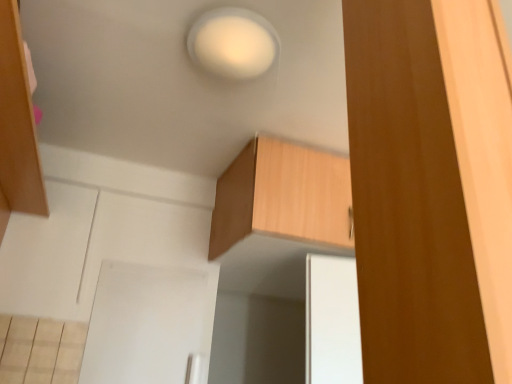
Identify the location of wooden cabinet at upper center, which appears as the second cabinetry when viewed from the front. This screenshot has height=384, width=512. (283, 197).

This screenshot has width=512, height=384. Identify the location of white matte light at upper center. (233, 43).

Considering the relative positions of white matte light at upper center and wooden cabinet at upper center, which appears as the second cabinetry when viewed from the front, in the image provided, is white matte light at upper center to the right of wooden cabinet at upper center, which appears as the second cabinetry when viewed from the front, from the viewer's perspective?

Incorrect, white matte light at upper center is not on the right side of wooden cabinet at upper center, which appears as the second cabinetry when viewed from the front.

From the image's perspective, is white matte light at upper center above or below wooden cabinet at upper center, which appears as the second cabinetry when viewed from the front?

From the image's perspective, white matte light at upper center appears above wooden cabinet at upper center, which appears as the second cabinetry when viewed from the front.

From the picture: Is white matte light at upper center oriented away from wooden cabinet at upper center, which is counted as the first cabinetry, starting from the back?

No, wooden cabinet at upper center, which is counted as the first cabinetry, starting from the back, is not at the back of white matte light at upper center.

Would you say white matte light at upper center contains wooden cabinet at upper center, which appears as the second cabinetry when viewed from the front?

Definitely not — wooden cabinet at upper center, which appears as the second cabinetry when viewed from the front, is not inside white matte light at upper center.

Can you tell me how much brown wood cabinet at right, which is the 2th cabinetry in back-to-front order, and wooden cabinet at upper center, which is counted as the first cabinetry, starting from the back, differ in facing direction?

95.8 degrees separate the facing orientations of brown wood cabinet at right, which is the 2th cabinetry in back-to-front order, and wooden cabinet at upper center, which is counted as the first cabinetry, starting from the back.

From a real-world perspective, is brown wood cabinet at right, which is the 2th cabinetry in back-to-front order, positioned over wooden cabinet at upper center, which appears as the second cabinetry when viewed from the front, based on gravity?

No, from a real-world perspective, brown wood cabinet at right, which is the 2th cabinetry in back-to-front order, is not over wooden cabinet at upper center, which appears as the second cabinetry when viewed from the front

From the image's perspective, relative to wooden cabinet at upper center, which appears as the second cabinetry when viewed from the front, is brown wood cabinet at right, the 1th cabinetry from the front, above or below?

brown wood cabinet at right, the 1th cabinetry from the front, is above wooden cabinet at upper center, which appears as the second cabinetry when viewed from the front.

How much distance is there between brown wood cabinet at right, the 1th cabinetry from the front, and white matte light at upper center?

brown wood cabinet at right, the 1th cabinetry from the front, and white matte light at upper center are 77.35 centimeters apart.

From a real-world perspective, is brown wood cabinet at right, the 1th cabinetry from the front, beneath white matte light at upper center?

Yes, from a real-world perspective, brown wood cabinet at right, the 1th cabinetry from the front, is beneath white matte light at upper center.

Consider the image. Would you say white matte light at upper center is part of wooden cabinet at upper center, which appears as the second cabinetry when viewed from the front,'s contents?

No.

Could you tell me if wooden cabinet at upper center, which appears as the second cabinetry when viewed from the front, is turned towards white matte light at upper center?

No, wooden cabinet at upper center, which appears as the second cabinetry when viewed from the front, is not facing towards white matte light at upper center.

From the image's perspective, is wooden cabinet at upper center, which appears as the second cabinetry when viewed from the front, under white matte light at upper center?

Yes, from the image's perspective, wooden cabinet at upper center, which appears as the second cabinetry when viewed from the front, is beneath white matte light at upper center.

Considering the sizes of objects wooden cabinet at upper center, which is counted as the first cabinetry, starting from the back, and white matte light at upper center in the image provided, who is wider, wooden cabinet at upper center, which is counted as the first cabinetry, starting from the back, or white matte light at upper center?

With larger width is wooden cabinet at upper center, which is counted as the first cabinetry, starting from the back.

From the image's perspective, is white matte light at upper center above or below brown wood cabinet at right, the 1th cabinetry from the front?

Based on their image positions, white matte light at upper center is located above brown wood cabinet at right, the 1th cabinetry from the front.

Does white matte light at upper center lie behind brown wood cabinet at right, which is the 2th cabinetry in back-to-front order?

Yes, it is behind brown wood cabinet at right, which is the 2th cabinetry in back-to-front order.

Can brown wood cabinet at right, which is the 2th cabinetry in back-to-front order, be found inside white matte light at upper center?

No, brown wood cabinet at right, which is the 2th cabinetry in back-to-front order, is not a part of white matte light at upper center.

Is white matte light at upper center next to brown wood cabinet at right, the 1th cabinetry from the front, and touching it?

There is a gap between white matte light at upper center and brown wood cabinet at right, the 1th cabinetry from the front.

Does wooden cabinet at upper center, which is counted as the first cabinetry, starting from the back, lie in front of brown wood cabinet at right, the 1th cabinetry from the front?

No, wooden cabinet at upper center, which is counted as the first cabinetry, starting from the back, is further to the viewer.

From the image's perspective, relative to brown wood cabinet at right, the 1th cabinetry from the front, is wooden cabinet at upper center, which appears as the second cabinetry when viewed from the front, above or below?

Based on their image positions, wooden cabinet at upper center, which appears as the second cabinetry when viewed from the front, is located beneath brown wood cabinet at right, the 1th cabinetry from the front.

Based on their sizes in the image, would you say wooden cabinet at upper center, which is counted as the first cabinetry, starting from the back, is bigger or smaller than brown wood cabinet at right, the 1th cabinetry from the front?

Clearly, wooden cabinet at upper center, which is counted as the first cabinetry, starting from the back, is larger in size than brown wood cabinet at right, the 1th cabinetry from the front.

Locate an element on the screen. This screenshot has height=384, width=512. cabinetry that appears behind the white matte light at upper center is located at coordinates (283, 197).

At what (x,y) coordinates should I click in order to perform the action: click on cabinetry on the left side of brown wood cabinet at right, which is the 2th cabinetry in back-to-front order. Please return your answer as a coordinate pair (x, y). Looking at the image, I should click on (283, 197).

Looking at the image, which one is located closer to white matte light at upper center, wooden cabinet at upper center, which appears as the second cabinetry when viewed from the front, or brown wood cabinet at right, which is the 2th cabinetry in back-to-front order?

wooden cabinet at upper center, which appears as the second cabinetry when viewed from the front.

Looking at the image, which one is located closer to brown wood cabinet at right, the 1th cabinetry from the front, wooden cabinet at upper center, which appears as the second cabinetry when viewed from the front, or white matte light at upper center?

white matte light at upper center is positioned closer to the anchor brown wood cabinet at right, the 1th cabinetry from the front.

From the image, which object appears to be farther from brown wood cabinet at right, the 1th cabinetry from the front, white matte light at upper center or wooden cabinet at upper center, which appears as the second cabinetry when viewed from the front?

Among the two, wooden cabinet at upper center, which appears as the second cabinetry when viewed from the front, is located further to brown wood cabinet at right, the 1th cabinetry from the front.

From the image, which object appears to be farther from wooden cabinet at upper center, which appears as the second cabinetry when viewed from the front, brown wood cabinet at right, the 1th cabinetry from the front, or white matte light at upper center?

brown wood cabinet at right, the 1th cabinetry from the front, lies further to wooden cabinet at upper center, which appears as the second cabinetry when viewed from the front, than the other object.

When comparing their distances from white matte light at upper center, does brown wood cabinet at right, which is the 2th cabinetry in back-to-front order, or wooden cabinet at upper center, which is counted as the first cabinetry, starting from the back, seem further?

brown wood cabinet at right, which is the 2th cabinetry in back-to-front order, is positioned further to the anchor white matte light at upper center.

Estimate the real-world distances between objects in this image. Which object is closer to wooden cabinet at upper center, which is counted as the first cabinetry, starting from the back, white matte light at upper center or brown wood cabinet at right, the 1th cabinetry from the front?

white matte light at upper center is positioned closer to the anchor wooden cabinet at upper center, which is counted as the first cabinetry, starting from the back.

Where is `light between brown wood cabinet at right, which is the 2th cabinetry in back-to-front order, and wooden cabinet at upper center, which appears as the second cabinetry when viewed from the front, along the z-axis`? The width and height of the screenshot is (512, 384). light between brown wood cabinet at right, which is the 2th cabinetry in back-to-front order, and wooden cabinet at upper center, which appears as the second cabinetry when viewed from the front, along the z-axis is located at coordinates (233, 43).